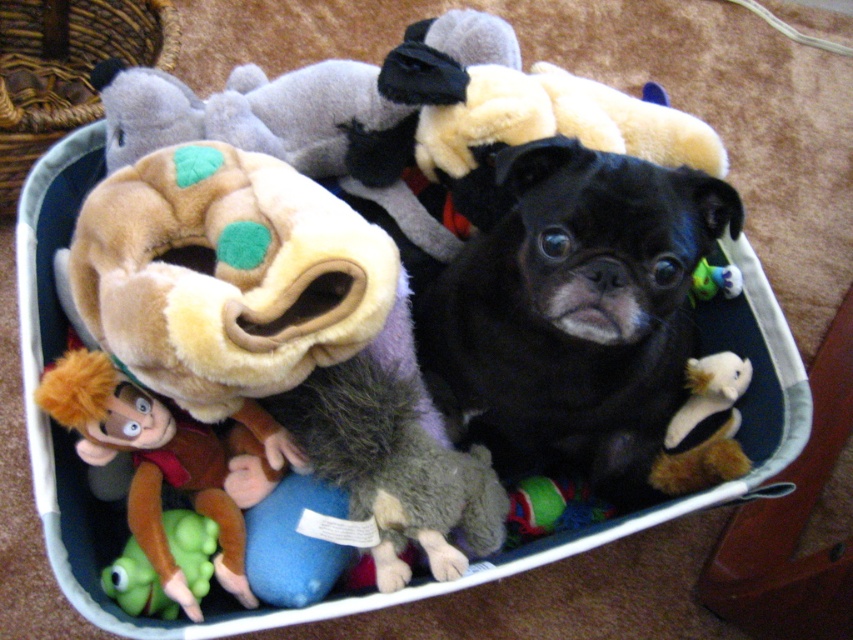
In the scene described, there are two green toys present. The green rubber toy at lower left and the green plush toy at upper right. From the perspective of someone looking at the image, which green toy is positioned more to the left?

The green rubber toy at lower left is positioned more to the left than the green plush toy at upper right.

You are a toy organizer trying to arrange the toys in the storage bin. You need to place the fuzzy white plush at lower right to the right of the black soft dog at center. Is the current arrangement already correct?

Yes, the current arrangement is correct because the black soft dog at center is positioned on the left side of fuzzy white plush at lower right, which matches the requirement to have the fuzzy white plush at lower right to the right of the black soft dog at center.